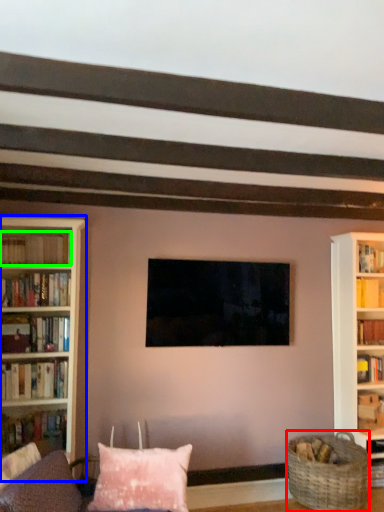
Question: Estimate the real-world distances between objects in this image. Which object is closer to basket (highlighted by a red box), bookcase (highlighted by a blue box) or book (highlighted by a green box)?

Choices:
 (A) bookcase
 (B) book

Answer: (A)